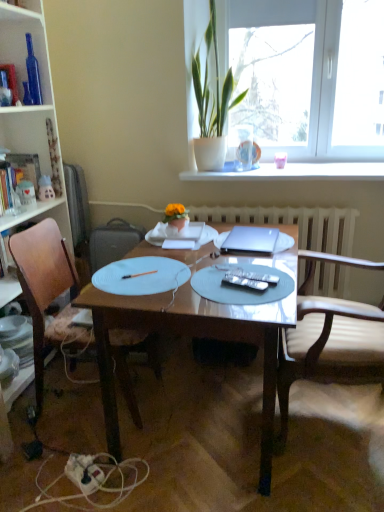
Measure the distance between point (247,283) and camera.

Point (247,283) and camera are 5.01 feet apart from each other.

You are a GUI agent. You are given a task and a screenshot of the screen. Output one action in this format:
    pyautogui.click(x=<x>, y=<y>)
    Task: Click on the matte plastic toy at left, which appears as the 1th toy when viewed from the left
    This screenshot has height=512, width=384.
    Given the screenshot: What is the action you would take?
    pyautogui.click(x=26, y=194)

Measure the distance between point [375,174] and camera.

A distance of 7.98 feet exists between point [375,174] and camera.

Measure the distance between green glossy plant at upper center and camera.

green glossy plant at upper center and camera are 7.89 feet apart.

Describe the element at coordinates (15, 327) in the screenshot. Image resolution: width=384 pixels, height=512 pixels. I see `matte white plate at lower left` at that location.

The width and height of the screenshot is (384, 512). Find the location of `silver metallic remote control at center`. silver metallic remote control at center is located at coordinates (245, 281).

Does matte blue paper plate at center, the 2th paper plate viewed from the left, have a smaller size compared to silver metallic remote control at center?

No, matte blue paper plate at center, the 2th paper plate viewed from the left, is not smaller than silver metallic remote control at center.

Relative to silver metallic remote control at center, is matte blue paper plate at center, the 2th paper plate viewed from the left, in front or behind?

matte blue paper plate at center, the 2th paper plate viewed from the left, is in front of silver metallic remote control at center.

Which object is thinner, matte blue paper plate at center, placed as the first paper plate when sorted from right to left, or silver metallic remote control at center?

Thinner between the two is silver metallic remote control at center.

Does matte blue paper plate at center, the 2th paper plate viewed from the left, appear on the right side of silver metallic remote control at center?

No, matte blue paper plate at center, the 2th paper plate viewed from the left, is not to the right of silver metallic remote control at center.

In the scene shown: Is matte white plate at lower left not close to satin silver laptop at center?

matte white plate at lower left is far away from satin silver laptop at center.

Considering the positions of objects matte white plate at lower left and satin silver laptop at center in the image provided, who is behind, matte white plate at lower left or satin silver laptop at center?

matte white plate at lower left is further from the camera.

Between point (11, 318) and point (268, 234), which one is positioned in front?

The point (268, 234) is in front.

Is matte white plate at lower left positioned beyond the bounds of satin silver laptop at center?

matte white plate at lower left is positioned outside satin silver laptop at center.

Looking at their sizes, would you say brown wood chair at left, which is the 1th chair in left-to-right order, is wider or thinner than matte blue paper plate at center, placed as the first paper plate when sorted from right to left?

brown wood chair at left, which is the 1th chair in left-to-right order, is wider than matte blue paper plate at center, placed as the first paper plate when sorted from right to left.

Considering their positions, is brown wood chair at left, which is the 1th chair in left-to-right order, located in front of or behind matte blue paper plate at center, placed as the first paper plate when sorted from right to left?

brown wood chair at left, which is the 1th chair in left-to-right order, is positioned farther from the viewer than matte blue paper plate at center, placed as the first paper plate when sorted from right to left.

How much distance is there between brown wood chair at left, acting as the second chair starting from the right, and matte blue paper plate at center, placed as the first paper plate when sorted from right to left?

The distance of brown wood chair at left, acting as the second chair starting from the right, from matte blue paper plate at center, placed as the first paper plate when sorted from right to left, is 29.93 inches.

From the picture: Is matte blue paper plate at center, the 2th paper plate viewed from the left, a part of brown wood chair at left, acting as the second chair starting from the right?

No, matte blue paper plate at center, the 2th paper plate viewed from the left, is located outside of brown wood chair at left, acting as the second chair starting from the right.

From a real-world perspective, which is physically above, white glossy window sill at upper center or matte plastic toy at left, acting as the 1th toy starting from the right?

white glossy window sill at upper center, from a real-world perspective.

Does point (321, 165) come farther from viewer compared to point (43, 197)?

Yes, it is.

Could you tell me if white glossy window sill at upper center is turned towards matte plastic toy at left, acting as the 2th toy starting from the left?

No, white glossy window sill at upper center is not facing towards matte plastic toy at left, acting as the 2th toy starting from the left.

Is brown wood chair at left, acting as the second chair starting from the right, positioned with its back to white glossy window sill at upper center?

No.

Relative to white glossy window sill at upper center, is brown wood chair at left, which is the 1th chair in left-to-right order, in front or behind?

Visually, brown wood chair at left, which is the 1th chair in left-to-right order, is located in front of white glossy window sill at upper center.

Visually, is brown wood chair at left, acting as the second chair starting from the right, positioned to the left or to the right of white glossy window sill at upper center?

Based on their positions, brown wood chair at left, acting as the second chair starting from the right, is located to the left of white glossy window sill at upper center.

Which of these two, brown wood chair at left, which is the 1th chair in left-to-right order, or white glossy window sill at upper center, is thinner?

With smaller width is white glossy window sill at upper center.

Considering the positions of point (22, 129) and point (237, 236), is point (22, 129) closer or farther from the camera than point (237, 236)?

Point (22, 129) is farther from the camera than point (237, 236).

From a real-world perspective, is wooden bookcase at left positioned over satin silver laptop at center based on gravity?

Yes, from a real-world perspective, wooden bookcase at left is on top of satin silver laptop at center.

From the image's perspective, would you say wooden bookcase at left is shown under satin silver laptop at center?

No.

Is satin silver laptop at center located within wooden bookcase at left?

Definitely not — satin silver laptop at center is not inside wooden bookcase at left.

In terms of height, does matte plastic toy at left, which appears as the 1th toy when viewed from the left, look taller or shorter compared to light brown leather chair at right, the 2th chair in the left-to-right sequence?

matte plastic toy at left, which appears as the 1th toy when viewed from the left, is shorter than light brown leather chair at right, the 2th chair in the left-to-right sequence.

Considering the sizes of matte plastic toy at left, which appears as the 1th toy when viewed from the left, and light brown leather chair at right, the first chair from the right, in the image, is matte plastic toy at left, which appears as the 1th toy when viewed from the left, wider or thinner than light brown leather chair at right, the first chair from the right,?

matte plastic toy at left, which appears as the 1th toy when viewed from the left, is thinner than light brown leather chair at right, the first chair from the right.

Is point (17, 185) farther from viewer compared to point (309, 340)?

Yes, it is.

From the image's perspective, is matte plastic toy at left, which appears as the 1th toy when viewed from the left, located above light brown leather chair at right, the 2th chair in the left-to-right sequence?

Yes, from the image's perspective, matte plastic toy at left, which appears as the 1th toy when viewed from the left, is on top of light brown leather chair at right, the 2th chair in the left-to-right sequence.

Locate an element on the screen. the 2nd paper plate in front when counting from the silver metallic remote control at center is located at coordinates (239, 287).

Identify the location of laptop on the right of matte white plate at lower left. This screenshot has width=384, height=512. (251, 240).

Estimate the real-world distances between objects in this image. Which object is further from white matte paper plate at center, arranged as the second paper plate when viewed from the right, light brown leather chair at right, the first chair from the right, or white textured radiator at center?

white textured radiator at center is further to white matte paper plate at center, arranged as the second paper plate when viewed from the right.

Considering their positions, is matte white plate at lower left positioned further to brown wood chair at left, which is the 1th chair in left-to-right order, than white glossy window sill at upper center?

white glossy window sill at upper center is positioned further to the anchor brown wood chair at left, which is the 1th chair in left-to-right order.

Estimate the real-world distances between objects in this image. Which object is closer to brown wood chair at left, acting as the second chair starting from the right, wooden desk at center or green glossy plant at upper center?

Among the two, wooden desk at center is located nearer to brown wood chair at left, acting as the second chair starting from the right.

Estimate the real-world distances between objects in this image. Which object is further from transparent glass window at upper center, hardcover book at left or wooden bookcase at left?

hardcover book at left is positioned further to the anchor transparent glass window at upper center.

Which object lies further to the anchor point silver metallic remote control at center, matte plastic toy at left, acting as the 2th toy starting from the left, or white paper notebook at center?

Based on the image, matte plastic toy at left, acting as the 2th toy starting from the left, appears to be further to silver metallic remote control at center.

Looking at the image, which one is located further to wooden desk at center, silver metallic remote control at center or satin silver laptop at center?

The object further to wooden desk at center is satin silver laptop at center.

From the image, which object appears to be nearer to satin silver laptop at center, wooden desk at center or white paper notebook at center?

The object closer to satin silver laptop at center is white paper notebook at center.

Looking at the image, which one is located further to transparent glass window at upper center, matte blue paper plate at center, the 2th paper plate viewed from the left, or white glossy window sill at upper center?

matte blue paper plate at center, the 2th paper plate viewed from the left.

Where is `laptop between green glossy plant at upper center and wooden desk at center in the vertical direction`? The image size is (384, 512). laptop between green glossy plant at upper center and wooden desk at center in the vertical direction is located at coordinates (251, 240).

This screenshot has height=512, width=384. In order to click on window sill between transparent glass window at upper center and satin silver laptop at center in the vertical direction in this screenshot , I will do `click(294, 172)`.

The width and height of the screenshot is (384, 512). What are the coordinates of `notebook between hardcover book at left and matte blue paper plate at center, the 2th paper plate viewed from the left, in the horizontal direction` in the screenshot? It's located at (178, 244).

Where is `radiator situated between hardcover book at left and light brown leather chair at right, the 2th chair in the left-to-right sequence, from left to right`? radiator situated between hardcover book at left and light brown leather chair at right, the 2th chair in the left-to-right sequence, from left to right is located at coordinates (293, 223).